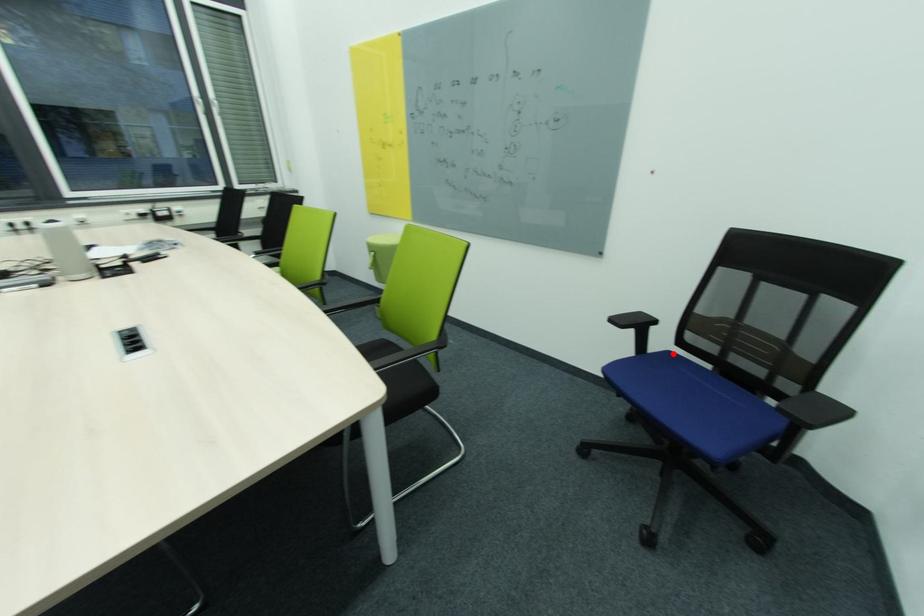
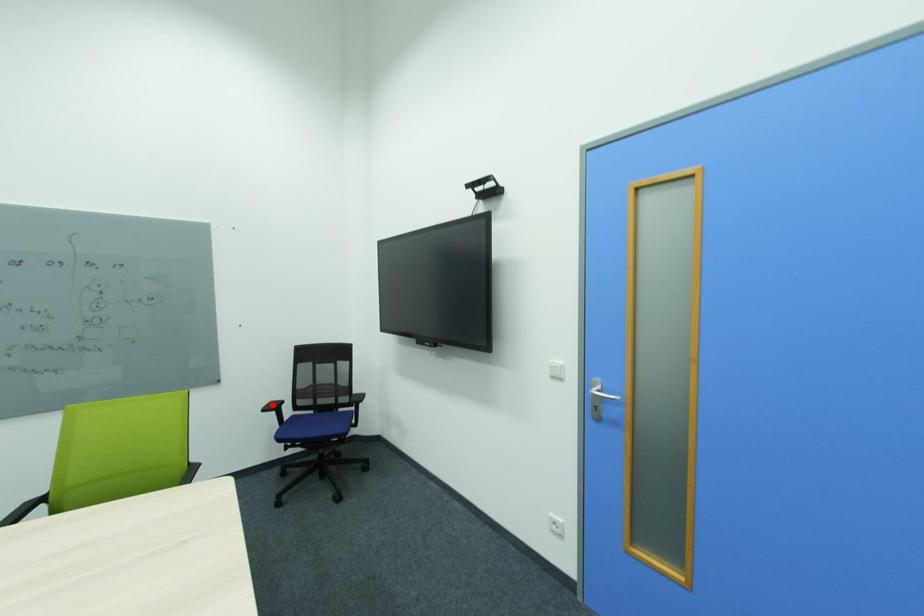
I am providing you with two images of the same scene from different viewpoints. A red point is marked on the first image and another point is marked on the second image. Does the point marked in image1 correspond to the same location as the one in image2?

No